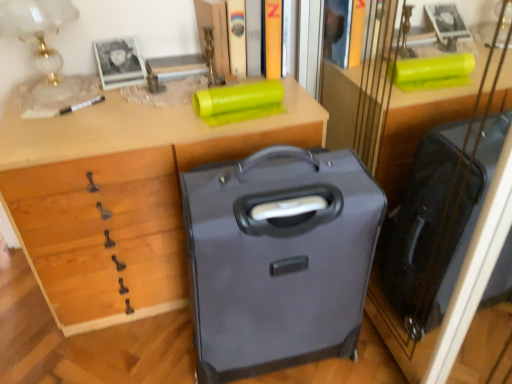
Question: From their relative heights in the image, would you say matte plastic book at upper center, the 2th book from the right, is taller or shorter than matte glass table lamp at upper left?

Choices:
 (A) short
 (B) tall

Answer: (A)

Question: Considering the positions of matte plastic book at upper center, the 2th book from the right, and matte glass table lamp at upper left in the image, is matte plastic book at upper center, the 2th book from the right, wider or thinner than matte glass table lamp at upper left?

Choices:
 (A) wide
 (B) thin

Answer: (B)

Question: Which of these objects is positioned farthest from the matte glass table lamp at upper left?

Choices:
 (A) matte plastic book at upper center, the 2th book from the right
 (B) hardcover book at upper center, arranged as the second book when viewed from the left
 (C) matte gray suitcase at center
 (D) matte wood desk at center

Answer: (C)

Question: Which object is the farthest from the hardcover book at upper center, which is the 1th book from right to left?

Choices:
 (A) matte glass table lamp at upper left
 (B) matte wood desk at center
 (C) matte gray suitcase at center
 (D) matte plastic book at upper center, the 2th book from the right

Answer: (C)